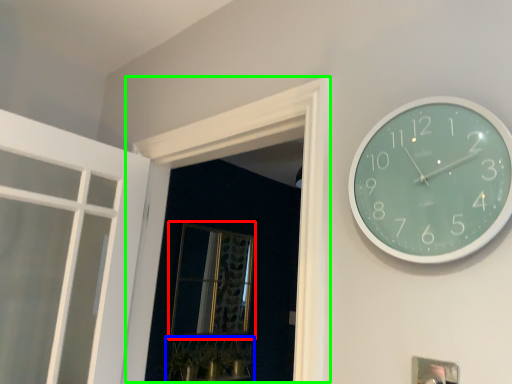
Question: Based on their relative distances, which object is nearer to window (highlighted by a red box)? Choose from plant (highlighted by a blue box) and window frame (highlighted by a green box).

Choices:
 (A) plant
 (B) window frame

Answer: (A)